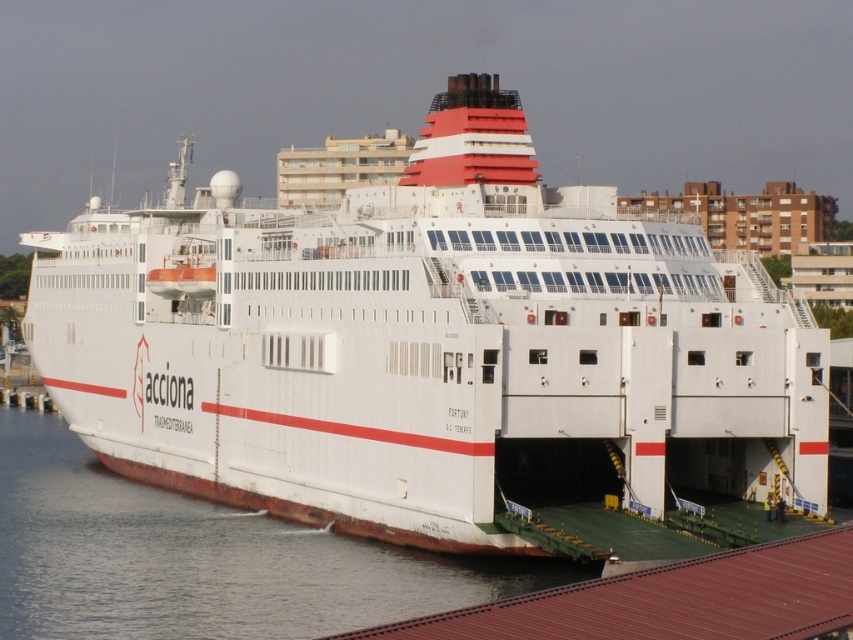
You are a crane operator tasked with loading a container onto the white matte ship at center and the brown corrugated metal dock at lower right. Which one requires the crane to lift the container higher due to their size difference?

The white matte ship at center requires the crane to lift the container higher because it has a larger size compared to the brown corrugated metal dock at lower right.